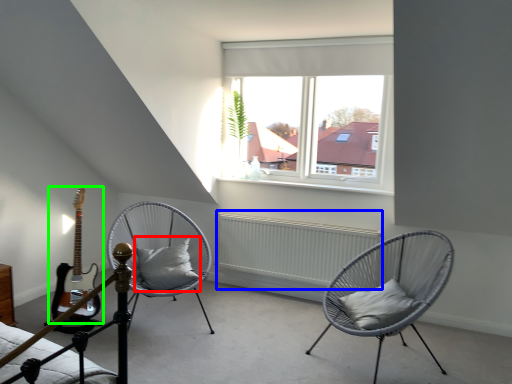
Question: Which object is positioned closest to pillow (highlighted by a red box)? Select from radiator (highlighted by a blue box) and guitar (highlighted by a green box).

Choices:
 (A) radiator
 (B) guitar

Answer: (B)